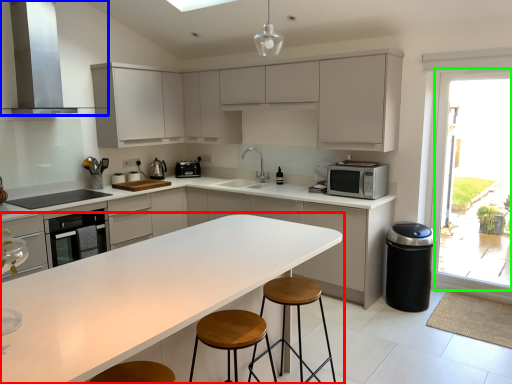
Question: Estimate the real-world distances between objects in this image. Which object is farther from countertop (highlighted by a red box), home appliance (highlighted by a blue box) or window (highlighted by a green box)?

Choices:
 (A) home appliance
 (B) window

Answer: (B)